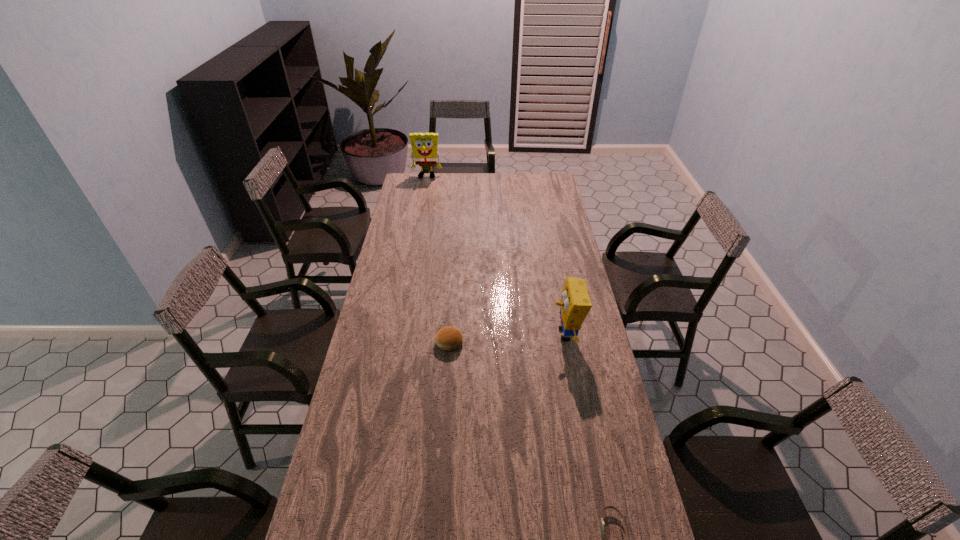
Find the location of a particular element. The height and width of the screenshot is (540, 960). unoccupied area between the nearer sponge and the farthest object is located at coordinates pos(496,255).

Image resolution: width=960 pixels, height=540 pixels. I want to click on vacant space in between the second object from left to right and the farthest object, so click(438, 260).

Identify the location of vacant space that's between the nearer sponge and the second shortest object. (507, 339).

Find the location of `vacant space in between the leftmost object and the right sponge`. vacant space in between the leftmost object and the right sponge is located at coordinates (496, 255).

Identify which object is the second closest to the farther sponge. Please provide its 2D coordinates. Your answer should be formatted as a tuple, i.e. [(x, y)], where the tuple contains the x and y coordinates of a point satisfying the conditions above.

[(450, 339)]

Identify the location of object that is the closest to the nearest object. Image resolution: width=960 pixels, height=540 pixels. (575, 304).

The width and height of the screenshot is (960, 540). I want to click on free space that satisfies the following two spatial constraints: 1. on the face of the leftmost object; 2. on the right side of the patty, so click(396, 342).

Find the location of a particular element. The width and height of the screenshot is (960, 540). free space that satisfies the following two spatial constraints: 1. on the face of the third object from right to left; 2. on the left side of the farthest object is located at coordinates (396, 342).

The width and height of the screenshot is (960, 540). In order to click on free spot that satisfies the following two spatial constraints: 1. on the face of the second shortest object; 2. on the left side of the farther sponge in this screenshot , I will do `click(396, 342)`.